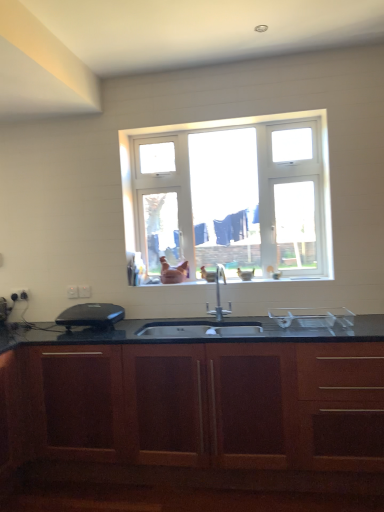
This screenshot has width=384, height=512. What do you see at coordinates (219, 295) in the screenshot?
I see `satin nickel faucet at center` at bounding box center [219, 295].

Describe the element at coordinates (91, 316) in the screenshot. I see `black plastic appliance at left` at that location.

Measure the distance between point (139, 243) and camera.

Point (139, 243) is 3.29 meters from camera.

Find the location of a particular element. This screenshot has height=512, width=384. white plastic electric outlet at lower left, positioned as the 1th electric outlet in left-to-right order is located at coordinates (19, 295).

Image resolution: width=384 pixels, height=512 pixels. What do you see at coordinates (72, 292) in the screenshot?
I see `white plastic electric outlet at lower left, which is counted as the second electric outlet, starting from the left` at bounding box center [72, 292].

What do you see at coordinates (84, 291) in the screenshot?
I see `white plastic electric outlet at lower left, which appears as the 1th electric outlet when viewed from the right` at bounding box center [84, 291].

Measure the distance between white plastic electric outlet at lower left, which is the first electric outlet from front to back, and camera.

The distance of white plastic electric outlet at lower left, which is the first electric outlet from front to back, from camera is 3.16 meters.

Locate an element on the screen. The width and height of the screenshot is (384, 512). satin nickel faucet at center is located at coordinates (219, 295).

In the image, is white glossy sink at center positioned in front of or behind wooden cabinet at center?

white glossy sink at center is behind wooden cabinet at center.

Can you confirm if white glossy sink at center is wider than wooden cabinet at center?

No, white glossy sink at center is not wider than wooden cabinet at center.

Would you consider white glossy sink at center to be distant from wooden cabinet at center?

Actually, white glossy sink at center and wooden cabinet at center are a little close together.

From a real-world perspective, which is physically below, white plastic window at center or black plastic appliance at left?

black plastic appliance at left is physically lower.

Can you tell me how much white plastic window at center and black plastic appliance at left differ in facing direction?

white plastic window at center and black plastic appliance at left are facing 0.969 degrees away from each other.

Considering the positions of point (324, 269) and point (85, 310), is point (324, 269) closer or farther from the camera than point (85, 310)?

Point (324, 269).

Could black plastic appliance at left be considered to be inside white plastic window at center?

Actually, black plastic appliance at left is outside white plastic window at center.

Between white plastic electric outlet at lower left, the first electric outlet in the back-to-front sequence, and white plastic window at center, which one is positioned behind?

white plastic electric outlet at lower left, the first electric outlet in the back-to-front sequence, is more distant.

Based on their sizes in the image, would you say white plastic electric outlet at lower left, which is the third electric outlet from front to back, is bigger or smaller than white plastic window at center?

In the image, white plastic electric outlet at lower left, which is the third electric outlet from front to back, appears to be smaller than white plastic window at center.

Is the surface of white plastic electric outlet at lower left, which is counted as the third electric outlet, starting from the right, in direct contact with white plastic window at center?

No, white plastic electric outlet at lower left, which is counted as the third electric outlet, starting from the right, is not next to white plastic window at center.

Looking at this image, is white plastic electric outlet at lower left, positioned as the 1th electric outlet in left-to-right order, facing towards white plastic window at center?

No.

Can you see white plastic electric outlet at lower left, the second electric outlet viewed from the right, touching white plastic electric outlet at lower left, the third electric outlet positioned from the left?

Yes, white plastic electric outlet at lower left, the second electric outlet viewed from the right, and white plastic electric outlet at lower left, the third electric outlet positioned from the left, clearly make contact.

Considering the positions of objects white plastic electric outlet at lower left, the 2th electric outlet when ordered from front to back, and white plastic electric outlet at lower left, which appears as the 1th electric outlet when viewed from the right, in the image provided, who is more to the right, white plastic electric outlet at lower left, the 2th electric outlet when ordered from front to back, or white plastic electric outlet at lower left, which appears as the 1th electric outlet when viewed from the right,?

From the viewer's perspective, white plastic electric outlet at lower left, which appears as the 1th electric outlet when viewed from the right, appears more on the right side.

Considering the points (74, 293) and (87, 295), which point is behind, point (74, 293) or point (87, 295)?

The point (74, 293) is more distant.

Are wooden cabinet at center and white plastic electric outlet at lower left, the second electric outlet viewed from the right, making contact?

There is a gap between wooden cabinet at center and white plastic electric outlet at lower left, the second electric outlet viewed from the right.

Considering the relative positions of wooden cabinet at center and white plastic electric outlet at lower left, which is counted as the second electric outlet, starting from the left, in the image provided, is wooden cabinet at center to the left of white plastic electric outlet at lower left, which is counted as the second electric outlet, starting from the left, from the viewer's perspective?

No.

Between wooden cabinet at center and white plastic electric outlet at lower left, the second electric outlet viewed from the right, which one has more height?

wooden cabinet at center is taller.

Looking at this image, from a real-world perspective, does wooden cabinet at center stand above white plastic electric outlet at lower left, which is counted as the second electric outlet, starting from the left?

No, from a real-world perspective, wooden cabinet at center is not on top of white plastic electric outlet at lower left, which is counted as the second electric outlet, starting from the left.

Is there a large distance between black plastic appliance at left and wooden cabinet at center?

No, black plastic appliance at left is in close proximity to wooden cabinet at center.

Which is more to the left, black plastic appliance at left or wooden cabinet at center?

Positioned to the left is black plastic appliance at left.

From a real-world perspective, between black plastic appliance at left and wooden cabinet at center, who is vertically higher?

From a 3D spatial view, black plastic appliance at left is above.

In the scene shown: Considering the relative sizes of black plastic appliance at left and wooden cabinet at center in the image provided, is black plastic appliance at left bigger than wooden cabinet at center?

No, black plastic appliance at left is not bigger than wooden cabinet at center.

From the image's perspective, which is above, white plastic window at center or white glossy sink at center?

From the image's view, white plastic window at center is above.

From a real-world perspective, is white plastic window at center beneath white glossy sink at center?

Actually, white plastic window at center is physically above white glossy sink at center in the real world.

Consider the image. Is white plastic window at center inside or outside of white glossy sink at center?

white plastic window at center is spatially situated outside white glossy sink at center.

Does point (310, 200) come farther from viewer compared to point (207, 271)?

No, (310, 200) is closer to viewer.

At what (x,y) coordinates should I click in order to perform the action: click on window sill above the wooden cabinet at center (from the image's perspective). Please return your answer as a coordinate pair (x, y). Looking at the image, I should click on (276, 278).

The width and height of the screenshot is (384, 512). In order to click on appliance below the white plastic window at center (from a real-world perspective) in this screenshot , I will do `click(91, 316)`.

Based on their spatial positions, is white plastic electric outlet at lower left, the 3th electric outlet from the back, or white plastic electric outlet at lower left, the first electric outlet in the back-to-front sequence, closer to white glossy sink at center?

white plastic electric outlet at lower left, the 3th electric outlet from the back, is positioned closer to the anchor white glossy sink at center.

Looking at the image, which one is located closer to white plastic window at center, satin nickel faucet at center or wooden cabinet at center?

satin nickel faucet at center.

From the image, which object appears to be nearer to white glossy sink at center, white plastic window at center or white plastic electric outlet at lower left, which appears as the second electric outlet when viewed from the back?

white plastic window at center is closer to white glossy sink at center.

Based on their spatial positions, is white plastic electric outlet at lower left, the second electric outlet viewed from the right, or white glossy sink at center further from wooden cabinet at center?

Among the two, white plastic electric outlet at lower left, the second electric outlet viewed from the right, is located further to wooden cabinet at center.

In the scene shown: Estimate the real-world distances between objects in this image. Which object is closer to black plastic appliance at left, white plastic electric outlet at lower left, the third electric outlet positioned from the left, or white plastic window at center?

white plastic electric outlet at lower left, the third electric outlet positioned from the left.

When comparing their distances from white plastic window at center, does wooden cabinet at center or white plastic electric outlet at lower left, which is the third electric outlet from front to back, seem further?

Among the two, white plastic electric outlet at lower left, which is the third electric outlet from front to back, is located further to white plastic window at center.

From the picture: When comparing their distances from black plastic appliance at left, does wooden cabinet at center or white plastic electric outlet at lower left, the 3th electric outlet from the back, seem further?

The object further to black plastic appliance at left is wooden cabinet at center.

Which object lies further to the anchor point wooden cabinet at center, white plastic window at center or satin nickel faucet at center?

Among the two, white plastic window at center is located further to wooden cabinet at center.

The image size is (384, 512). What are the coordinates of `cabinetry between white plastic electric outlet at lower left, which appears as the second electric outlet when viewed from the back, and satin nickel faucet at center, in the horizontal direction` in the screenshot? It's located at (203, 401).

At what (x,y) coordinates should I click in order to perform the action: click on appliance between wooden cabinet at center and white plastic electric outlet at lower left, which appears as the 1th electric outlet when viewed from the right, in the front-back direction. Please return your answer as a coordinate pair (x, y). The width and height of the screenshot is (384, 512). Looking at the image, I should click on (91, 316).

Find the location of a particular element. This screenshot has height=512, width=384. cabinetry between black plastic appliance at left and white glossy sink at center is located at coordinates (203, 401).

I want to click on appliance between white plastic electric outlet at lower left, which appears as the second electric outlet when viewed from the back, and satin nickel faucet at center, in the horizontal direction, so click(x=91, y=316).